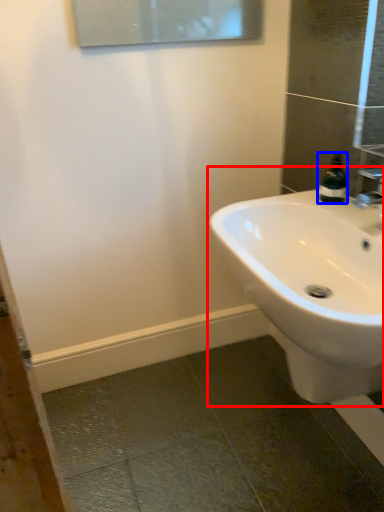
Question: Which point is further to the camera, sink (highlighted by a red box) or soap dispenser (highlighted by a blue box)?

Choices:
 (A) sink
 (B) soap dispenser

Answer: (B)